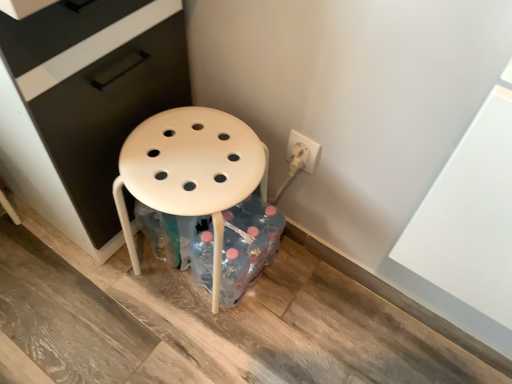
Question: From a real-world perspective, is white plastic outlet at right physically located above or below translucent plastic bottles at lower center?

Choices:
 (A) above
 (B) below

Answer: (A)

Question: Is white plastic outlet at right inside the boundaries of translucent plastic bottles at lower center, or outside?

Choices:
 (A) outside
 (B) inside

Answer: (A)

Question: Based on their relative distances, which object is farther from the matte black file cabinet at center?

Choices:
 (A) translucent plastic bottles at lower center
 (B) white plastic stool at center
 (C) white plastic outlet at right

Answer: (C)

Question: Based on their relative distances, which object is farther from the translucent plastic bottles at lower center?

Choices:
 (A) white plastic stool at center
 (B) matte black file cabinet at center
 (C) white plastic outlet at right

Answer: (B)